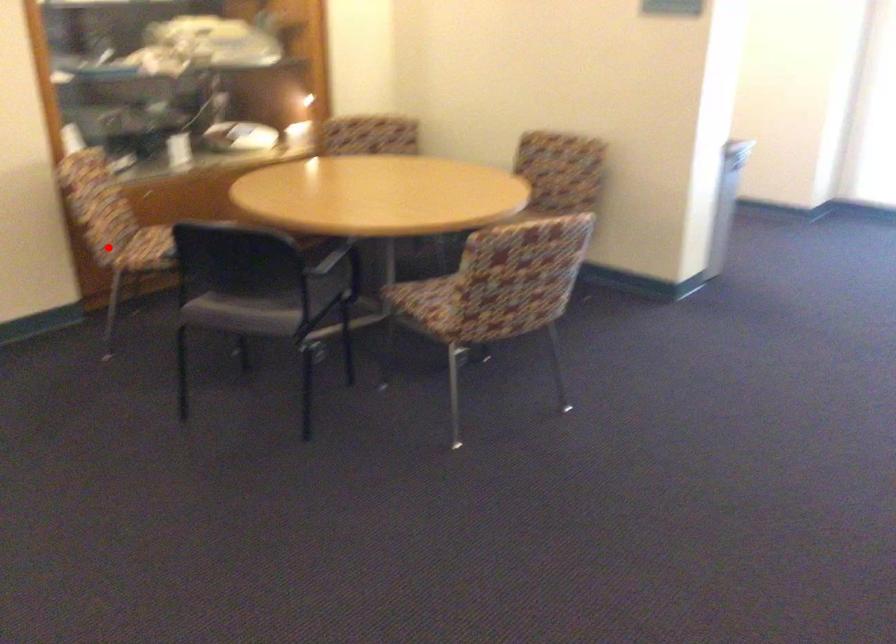
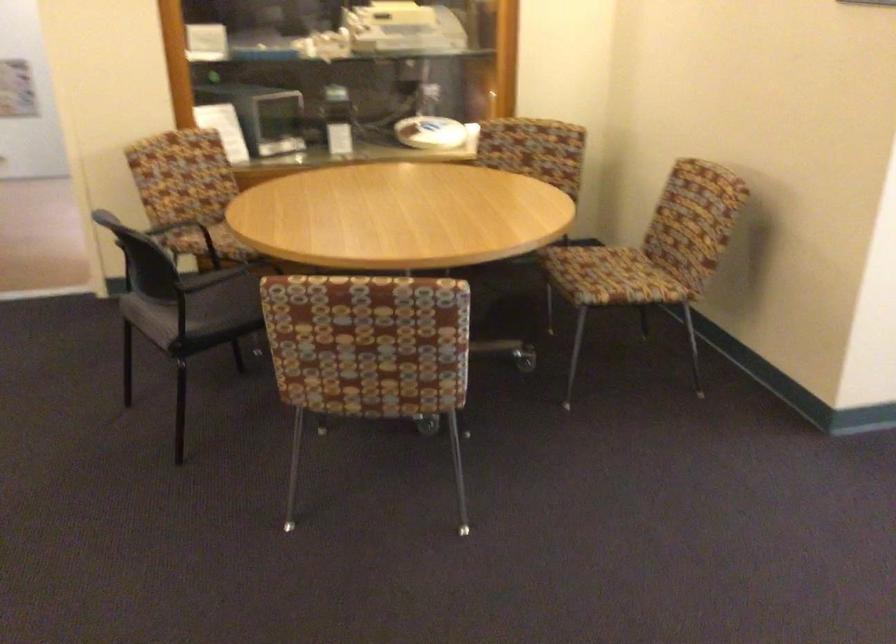
In the second image, find the point that corresponds to the highlighted location in the first image.

(167, 220)